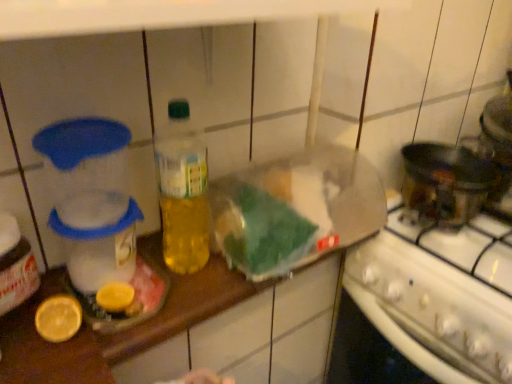
Question: Can you confirm if translucent plastic bottle at center is bigger than white glossy stove at lower right?

Choices:
 (A) no
 (B) yes

Answer: (A)

Question: Considering the relative sizes of translucent plastic bottle at center and white glossy stove at lower right in the image provided, is translucent plastic bottle at center wider than white glossy stove at lower right?

Choices:
 (A) yes
 (B) no

Answer: (B)

Question: Does translucent plastic bottle at center have a smaller size compared to white glossy stove at lower right?

Choices:
 (A) no
 (B) yes

Answer: (B)

Question: Is translucent plastic bottle at center looking in the opposite direction of white glossy stove at lower right?

Choices:
 (A) no
 (B) yes

Answer: (A)

Question: Is translucent plastic bottle at center facing towards white glossy stove at lower right?

Choices:
 (A) no
 (B) yes

Answer: (A)

Question: In terms of size, does translucent plastic bottle at center appear bigger or smaller than yellow matte lemon at lower left?

Choices:
 (A) small
 (B) big

Answer: (B)

Question: Is translucent plastic bottle at center in front of or behind yellow matte lemon at lower left in the image?

Choices:
 (A) behind
 (B) front

Answer: (A)

Question: Which is correct: translucent plastic bottle at center is inside yellow matte lemon at lower left, or outside of it?

Choices:
 (A) outside
 (B) inside

Answer: (A)

Question: From the image's perspective, is translucent plastic bottle at center located above or below yellow matte lemon at lower left?

Choices:
 (A) above
 (B) below

Answer: (A)

Question: From the image's perspective, is yellow matte lemon at lower left located above or below translucent plastic bottle at center?

Choices:
 (A) above
 (B) below

Answer: (B)

Question: Considering the positions of yellow matte lemon at lower left and translucent plastic bottle at center in the image, is yellow matte lemon at lower left bigger or smaller than translucent plastic bottle at center?

Choices:
 (A) small
 (B) big

Answer: (A)

Question: From a real-world perspective, is yellow matte lemon at lower left positioned above or below translucent plastic bottle at center?

Choices:
 (A) above
 (B) below

Answer: (B)

Question: Is yellow matte lemon at lower left in front of or behind translucent plastic bottle at center in the image?

Choices:
 (A) front
 (B) behind

Answer: (A)

Question: From a real-world perspective, is yellow matte lemon at lower left above or below white glossy stove at lower right?

Choices:
 (A) below
 (B) above

Answer: (B)

Question: In the image, is yellow matte lemon at lower left positioned in front of or behind white glossy stove at lower right?

Choices:
 (A) behind
 (B) front

Answer: (B)